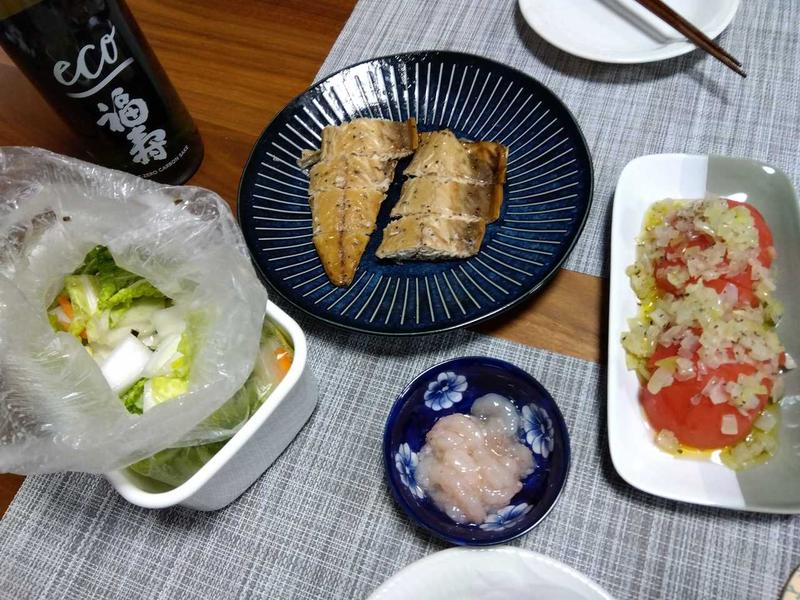
This screenshot has height=600, width=800. I want to click on chopsticks, so click(x=729, y=66).